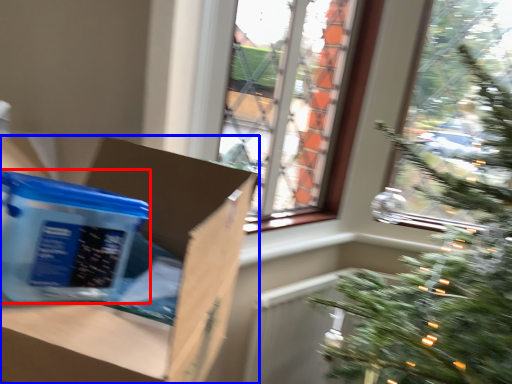
Question: Among these objects, which one is farthest to the camera, cardboard box (highlighted by a red box) or cardboard box (highlighted by a blue box)?

Choices:
 (A) cardboard box
 (B) cardboard box

Answer: (A)